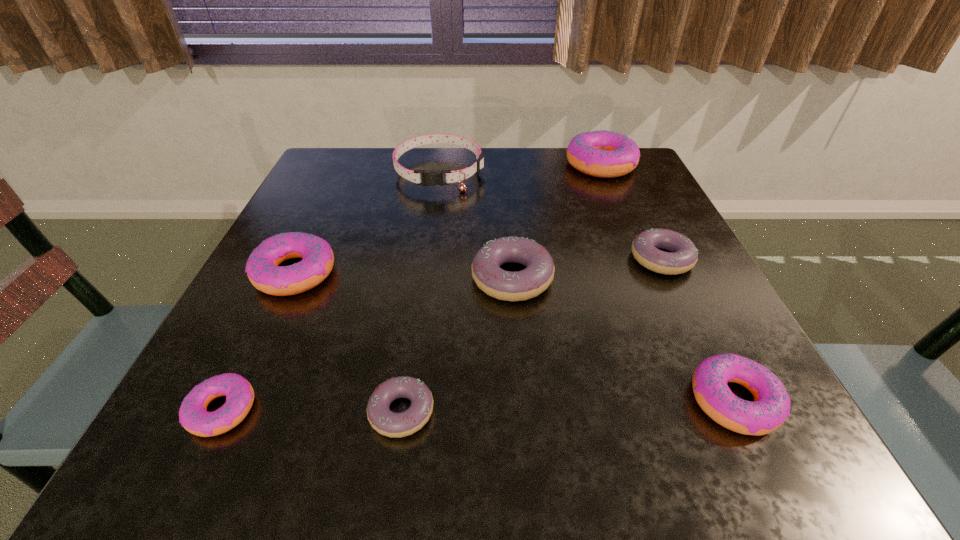
What are the coordinates of `vacant region that satisfies the following two spatial constraints: 1. on the back side of the biggest purple doughnut; 2. on the right side of the nearest purple doughnut` in the screenshot? It's located at (421, 278).

Identify the location of vacant position in the image that satisfies the following two spatial constraints: 1. with the buckle on the fourth doughnut from left to right; 2. on the right side of the pink dog collar. Image resolution: width=960 pixels, height=540 pixels. (425, 278).